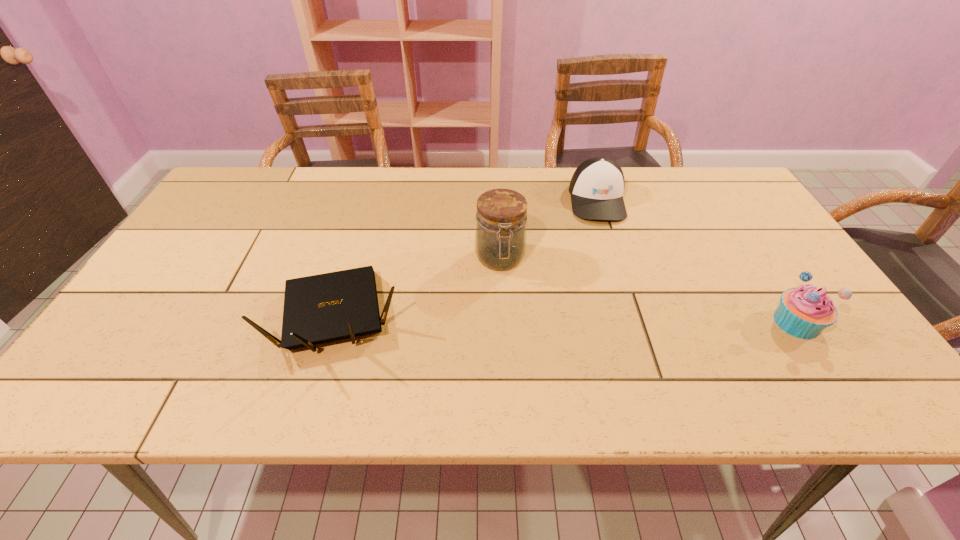
At what (x,y) coordinates should I click in order to perform the action: click on the leftmost object. Please return your answer as a coordinate pair (x, y). Image resolution: width=960 pixels, height=540 pixels. Looking at the image, I should click on (322, 308).

Find the location of a particular element. Image resolution: width=960 pixels, height=540 pixels. the rightmost object is located at coordinates (804, 312).

Locate an element on the screen. jar is located at coordinates (500, 238).

At what (x,y) coordinates should I click in order to perform the action: click on the second object from left to right. Please return your answer as a coordinate pair (x, y). Looking at the image, I should click on (500, 238).

You are a GUI agent. You are given a task and a screenshot of the screen. Output one action in this format:
    pyautogui.click(x=<x>, y=<y>)
    Task: Click on the second object from right to left
    This screenshot has width=960, height=540.
    Given the screenshot: What is the action you would take?
    pyautogui.click(x=597, y=186)

I want to click on the farthest object, so pyautogui.click(x=597, y=186).

I want to click on vacant space located 0.060m on the left of the leftmost object, so click(251, 316).

Find the location of `vacant space located on the back of the rightmost object`. vacant space located on the back of the rightmost object is located at coordinates (721, 206).

The height and width of the screenshot is (540, 960). Identify the location of blank area located on the lid of the second object from left to right. (514, 358).

Where is `vacant area situated on the lid of the second object from left to right`? The height and width of the screenshot is (540, 960). vacant area situated on the lid of the second object from left to right is located at coordinates (508, 318).